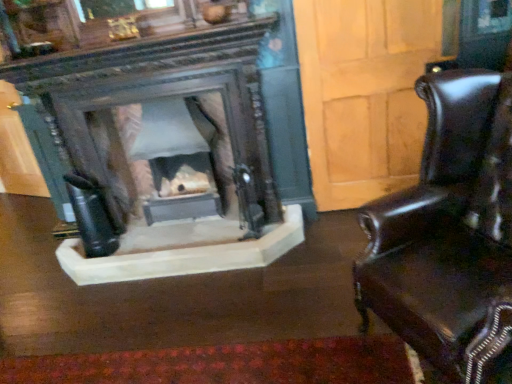
Question: Can you confirm if shiny brown leather chair at right is smaller than smooth stone fireplace at center?

Choices:
 (A) no
 (B) yes

Answer: (A)

Question: Is smooth stone fireplace at center at the back of shiny brown leather chair at right?

Choices:
 (A) no
 (B) yes

Answer: (A)

Question: Are shiny brown leather chair at right and smooth stone fireplace at center beside each other?

Choices:
 (A) yes
 (B) no

Answer: (B)

Question: Does shiny brown leather chair at right lie in front of smooth stone fireplace at center?

Choices:
 (A) no
 (B) yes

Answer: (B)

Question: Can smooth stone fireplace at center be found inside shiny brown leather chair at right?

Choices:
 (A) no
 (B) yes

Answer: (A)

Question: Is shiny brown leather chair at right located outside smooth stone fireplace at center?

Choices:
 (A) no
 (B) yes

Answer: (B)

Question: Does smooth stone fireplace at center have a lesser width compared to shiny brown leather chair at right?

Choices:
 (A) yes
 (B) no

Answer: (A)

Question: Is smooth stone fireplace at center taller than shiny brown leather chair at right?

Choices:
 (A) yes
 (B) no

Answer: (B)

Question: Does smooth stone fireplace at center have a larger size compared to shiny brown leather chair at right?

Choices:
 (A) no
 (B) yes

Answer: (A)

Question: Is shiny brown leather chair at right at the back of smooth stone fireplace at center?

Choices:
 (A) no
 (B) yes

Answer: (A)

Question: From a real-world perspective, is smooth stone fireplace at center on top of shiny brown leather chair at right?

Choices:
 (A) no
 (B) yes

Answer: (A)

Question: Would you say smooth stone fireplace at center contains shiny brown leather chair at right?

Choices:
 (A) no
 (B) yes

Answer: (A)

Question: In terms of height, does shiny brown leather chair at right look taller or shorter compared to smooth stone fireplace at center?

Choices:
 (A) short
 (B) tall

Answer: (B)